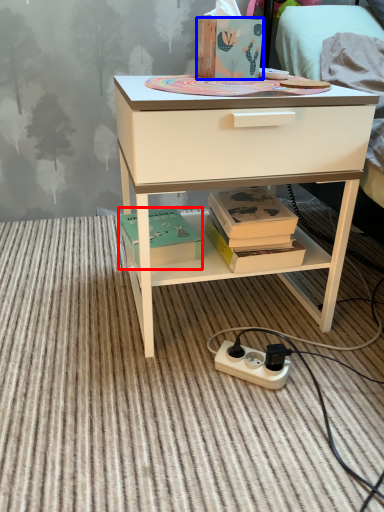
Question: Which object is closer to the camera taking this photo, box (highlighted by a red box) or box (highlighted by a blue box)?

Choices:
 (A) box
 (B) box

Answer: (B)